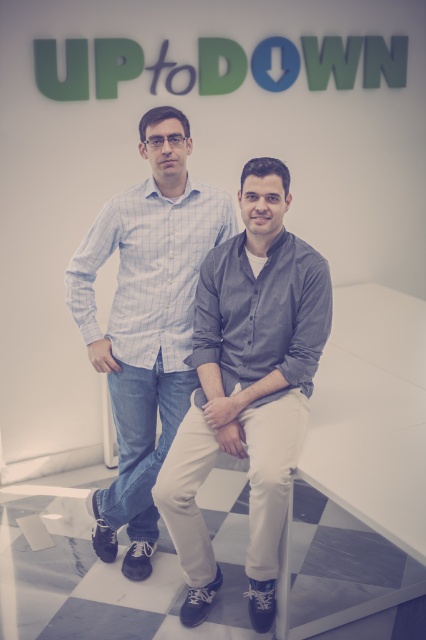
Is dark gray cotton shirt at center to the left of blue checkered shirt at center from the viewer's perspective?

In fact, dark gray cotton shirt at center is to the right of blue checkered shirt at center.

Between dark gray cotton shirt at center and blue checkered shirt at center, which one has more height?

blue checkered shirt at center is taller.

Which is in front, point (287, 346) or point (164, 182)?

Point (287, 346) is in front.

You are a GUI agent. You are given a task and a screenshot of the screen. Output one action in this format:
    pyautogui.click(x=<x>, y=<y>)
    Task: Click on the dark gray cotton shirt at center
    The image size is (426, 640).
    Given the screenshot: What is the action you would take?
    pyautogui.click(x=247, y=387)